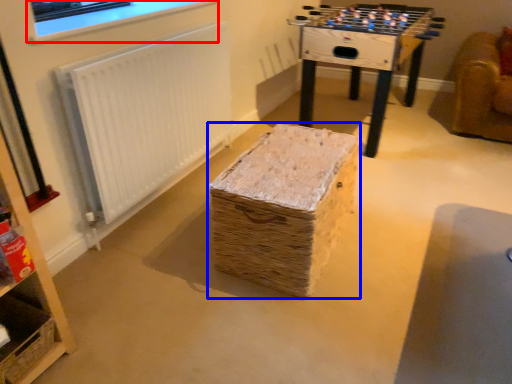
Question: Which point is closer to the camera, computer monitor (highlighted by a red box) or furniture (highlighted by a blue box)?

Choices:
 (A) computer monitor
 (B) furniture

Answer: (B)